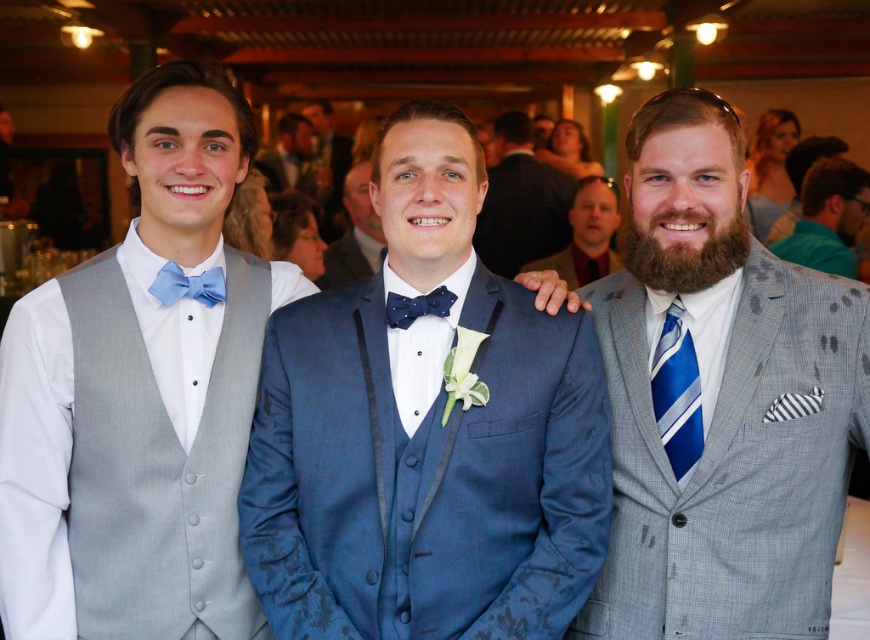
Question: Is gray checkered suit at right bigger than blue satin suit at center?

Choices:
 (A) yes
 (B) no

Answer: (A)

Question: Is blue striped tie at center thinner than blue textured suit at center?

Choices:
 (A) yes
 (B) no

Answer: (A)

Question: Which object is the farthest from the matte blue bow tie at left?

Choices:
 (A) teal fabric shirt at upper right
 (B) blue textured suit at center

Answer: (A)

Question: In this image, where is navy blue suit at center located relative to matte blue bow tie at center?

Choices:
 (A) below
 (B) above

Answer: (A)

Question: Which of the following is the farthest from the observer?

Choices:
 (A) blue satin bow tie at center
 (B) matte blue bow tie at center
 (C) matte gray suit at center

Answer: (C)

Question: Which of the following is the farthest from the observer?

Choices:
 (A) blue dotted fabric bow tie at center
 (B) matte blue bow tie at center
 (C) teal fabric shirt at upper right
 (D) blue striped tie at center

Answer: (D)